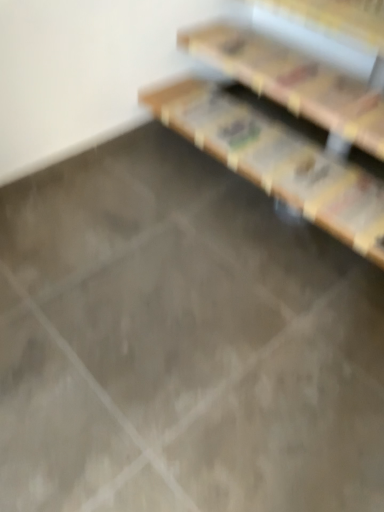
Question: Considering the relative positions of wooden bookshelf at upper right and wooden at upper right in the image provided, is wooden bookshelf at upper right to the left of wooden at upper right from the viewer's perspective?

Choices:
 (A) yes
 (B) no

Answer: (A)

Question: Is wooden bookshelf at upper right oriented towards wooden at upper right?

Choices:
 (A) no
 (B) yes

Answer: (A)

Question: From the image's perspective, is wooden bookshelf at upper right on top of wooden at upper right?

Choices:
 (A) yes
 (B) no

Answer: (B)

Question: Is wooden bookshelf at upper right shorter than wooden at upper right?

Choices:
 (A) no
 (B) yes

Answer: (A)

Question: Would you say wooden bookshelf at upper right is outside wooden at upper right?

Choices:
 (A) yes
 (B) no

Answer: (A)

Question: Can you confirm if wooden bookshelf at upper right is wider than wooden at upper right?

Choices:
 (A) no
 (B) yes

Answer: (B)

Question: Considering the relative sizes of wooden at upper right and wooden bookshelf at upper right in the image provided, is wooden at upper right bigger than wooden bookshelf at upper right?

Choices:
 (A) yes
 (B) no

Answer: (B)

Question: Is wooden at upper right turned away from wooden bookshelf at upper right?

Choices:
 (A) no
 (B) yes

Answer: (A)

Question: Is wooden at upper right not inside wooden bookshelf at upper right?

Choices:
 (A) yes
 (B) no

Answer: (A)

Question: From a real-world perspective, is wooden at upper right over wooden bookshelf at upper right?

Choices:
 (A) yes
 (B) no

Answer: (A)

Question: Is wooden at upper right taller than wooden bookshelf at upper right?

Choices:
 (A) yes
 (B) no

Answer: (B)

Question: From a real-world perspective, is wooden at upper right positioned under wooden bookshelf at upper right based on gravity?

Choices:
 (A) yes
 (B) no

Answer: (B)

Question: Would you say wooden at upper right is to the left or to the right of wooden bookshelf at upper right in the picture?

Choices:
 (A) left
 (B) right

Answer: (B)